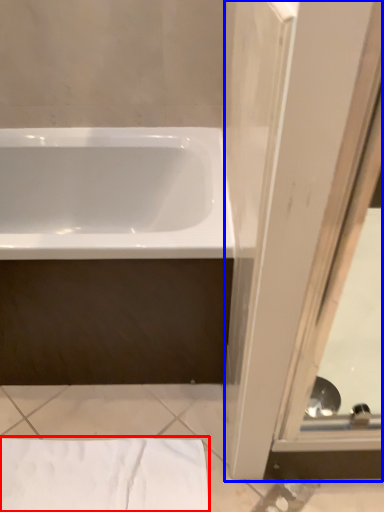
Question: Which point is closer to the camera, sheet (highlighted by a red box) or screen door (highlighted by a blue box)?

Choices:
 (A) sheet
 (B) screen door

Answer: (B)